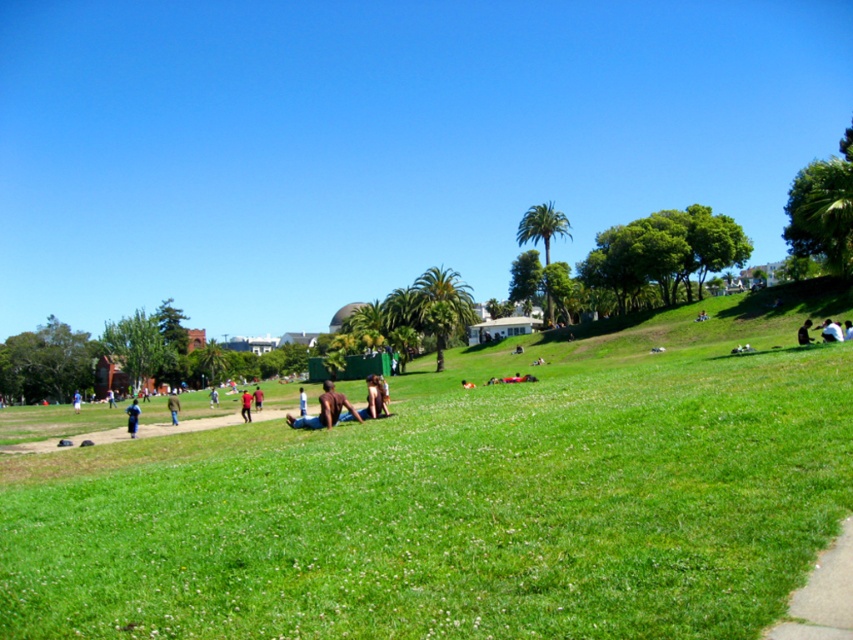
Can you confirm if green fabric jacket at center is positioned below light blue shirt at center?

Yes, green fabric jacket at center is below light blue shirt at center.

The height and width of the screenshot is (640, 853). Find the location of `green fabric jacket at center`. green fabric jacket at center is located at coordinates (173, 406).

Who is more forward, (167,403) or (300,397)?

Point (300,397)

I want to click on green fabric jacket at center, so click(173, 406).

Who is more distant from viewer, (134, 404) or (846, 332)?

Point (134, 404)

Is blue fabric shirt at lower left positioned behind light blue fabric at center?

Yes, blue fabric shirt at lower left is further from the viewer.

This screenshot has height=640, width=853. I want to click on blue fabric shirt at lower left, so click(132, 417).

Between blurred skin person at center and smooth tan skin at center, which one has more height?

With more height is blurred skin person at center.

Based on the photo, does blurred skin person at center appear on the left side of smooth tan skin at center?

Yes, blurred skin person at center is to the left of smooth tan skin at center.

Between point (329, 387) and point (370, 416), which one is positioned behind?

The point (370, 416) is more distant.

Find the location of a particular element. This screenshot has height=640, width=853. blurred skin person at center is located at coordinates (325, 410).